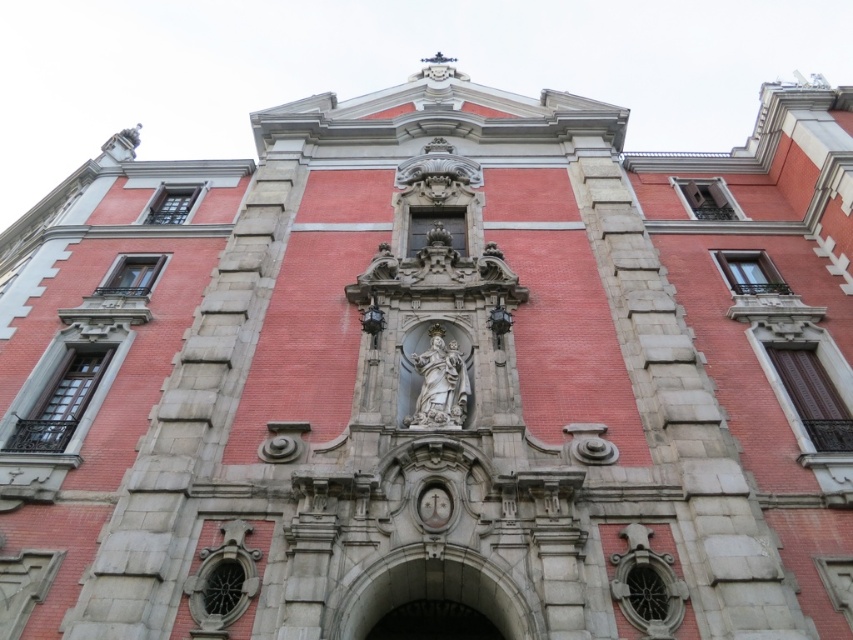
Is white stone arch at center positioned in front of white marble statue at center?

Yes, it is.

Is point (440, 589) positioned before point (424, 420)?

Yes, it is.

Who is more distant from viewer, (x=467, y=577) or (x=428, y=337)?

Positioned behind is point (x=428, y=337).

At what (x,y) coordinates should I click in order to perform the action: click on white stone arch at center. Please return your answer as a coordinate pair (x, y). The image size is (853, 640). Looking at the image, I should click on (434, 596).